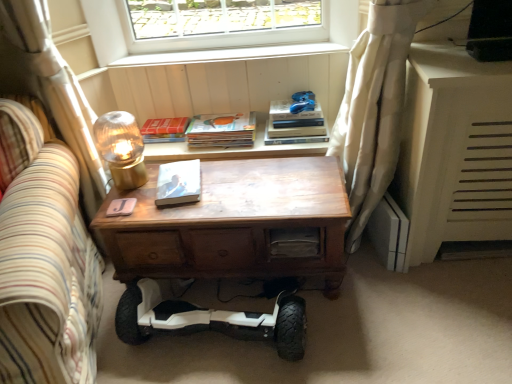
Find the location of a particular element. vacant space situated on the left part of blue fabric toy at upper center is located at coordinates (277, 106).